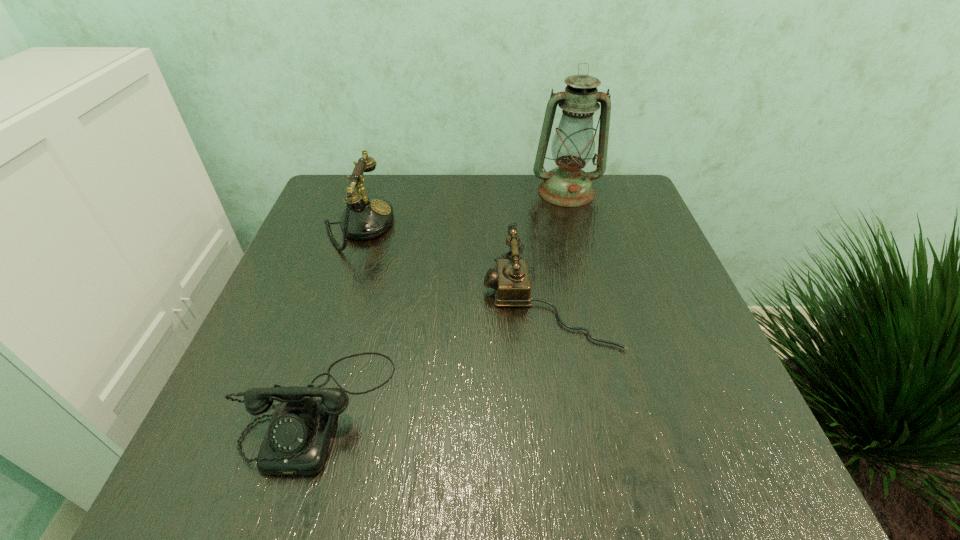
Where is `free spot that satisfies the following two spatial constraints: 1. on the dial of the rightmost telephone; 2. on the front-facing side of the shortest object`? free spot that satisfies the following two spatial constraints: 1. on the dial of the rightmost telephone; 2. on the front-facing side of the shortest object is located at coordinates (564, 408).

The image size is (960, 540). I want to click on free location that satisfies the following two spatial constraints: 1. on the dial of the third farthest object; 2. on the front-facing side of the shortest telephone, so (x=564, y=408).